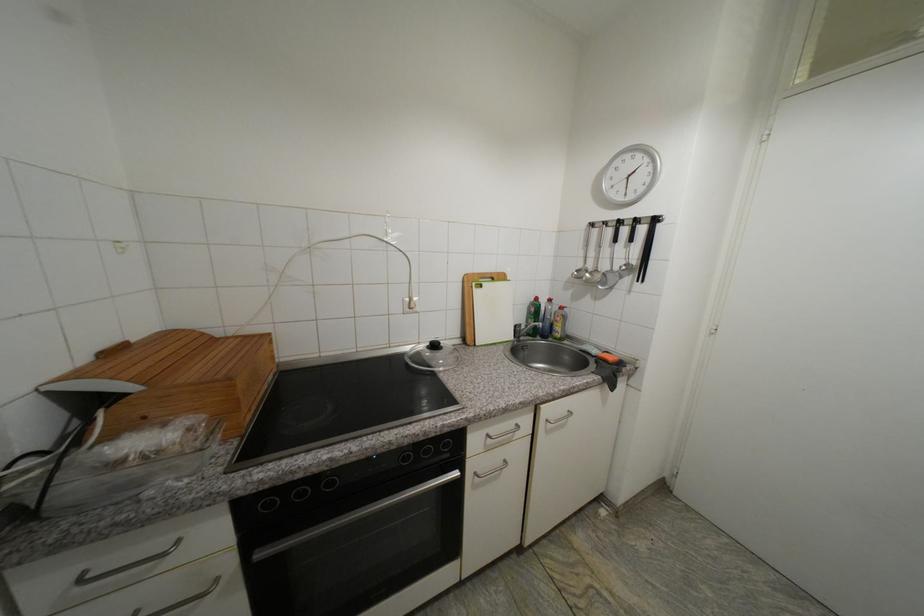
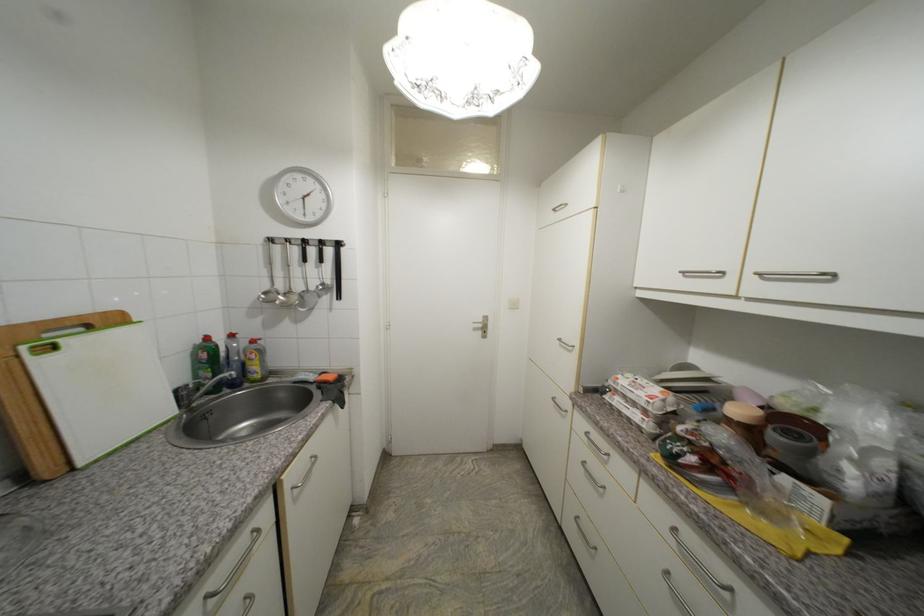
Where in the second image is the point corresponding to pixel 596 270 from the first image?

(287, 292)